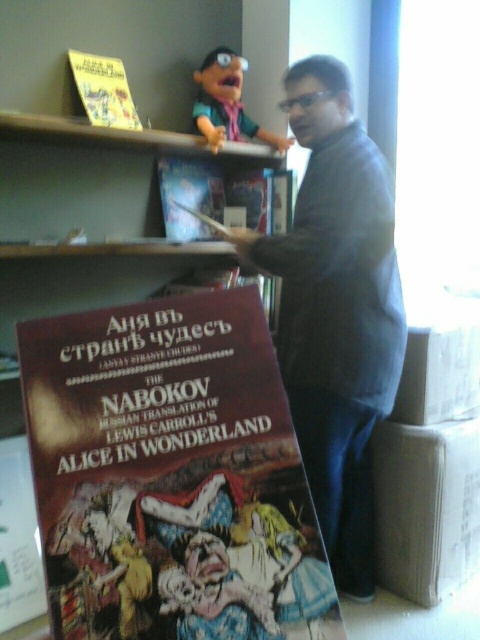
Question: Which object is positioned farthest from the dark gray sweater at center?

Choices:
 (A) pink fabric doll at upper center
 (B) yellow paper book at upper left

Answer: (B)

Question: Considering the relative positions of maroon paperback book at center and yellow paper book at upper left in the image provided, where is maroon paperback book at center located with respect to yellow paper book at upper left?

Choices:
 (A) right
 (B) left

Answer: (A)

Question: Estimate the real-world distances between objects in this image. Which object is farther from the pink fabric doll at upper center?

Choices:
 (A) dark gray sweater at center
 (B) maroon paperback book at center

Answer: (B)

Question: Which object is the closest to the yellow paper book at upper left?

Choices:
 (A) pink fabric doll at upper center
 (B) maroon paperback book at center

Answer: (A)

Question: Does maroon paperback book at center lie behind yellow paper book at upper left?

Choices:
 (A) no
 (B) yes

Answer: (A)

Question: Does dark gray sweater at center appear on the left side of yellow paper book at upper left?

Choices:
 (A) no
 (B) yes

Answer: (A)